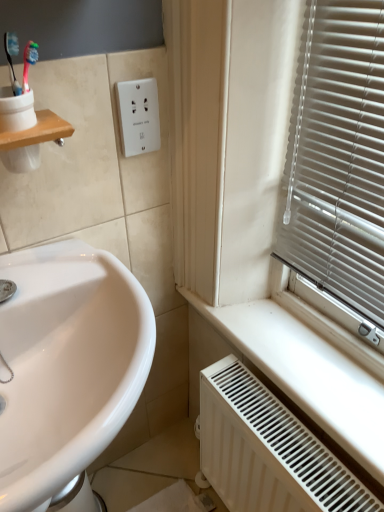
Identify the location of empty space that is ontop of white matte radiator at lower right. (271, 419).